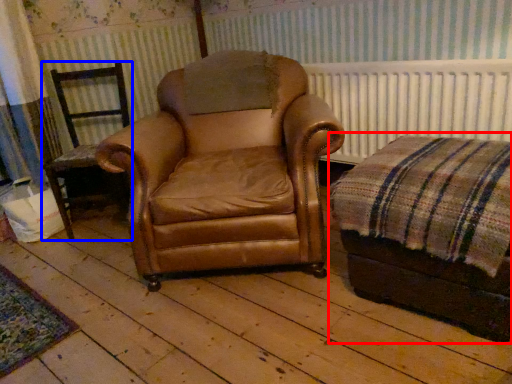
Question: Which point is further to the camera, couch (highlighted by a red box) or chair (highlighted by a blue box)?

Choices:
 (A) couch
 (B) chair

Answer: (B)